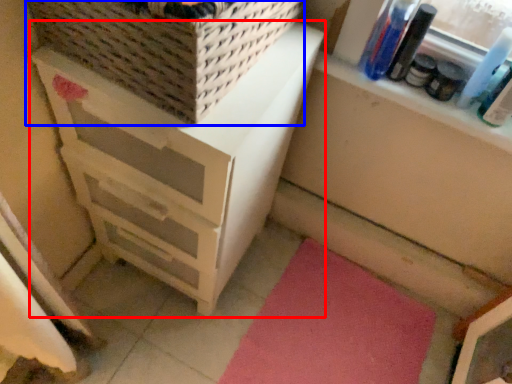
Question: Which point is closer to the camera, chest of drawers (highlighted by a red box) or basket (highlighted by a blue box)?

Choices:
 (A) chest of drawers
 (B) basket

Answer: (B)